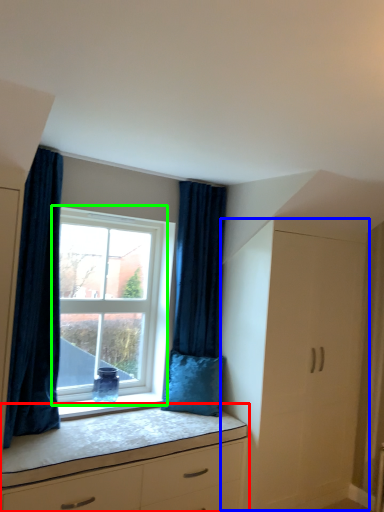
Question: Which object is positioned farthest from chest of drawers (highlighted by a red box)? Select from file cabinet (highlighted by a blue box) and window (highlighted by a green box).

Choices:
 (A) file cabinet
 (B) window

Answer: (B)